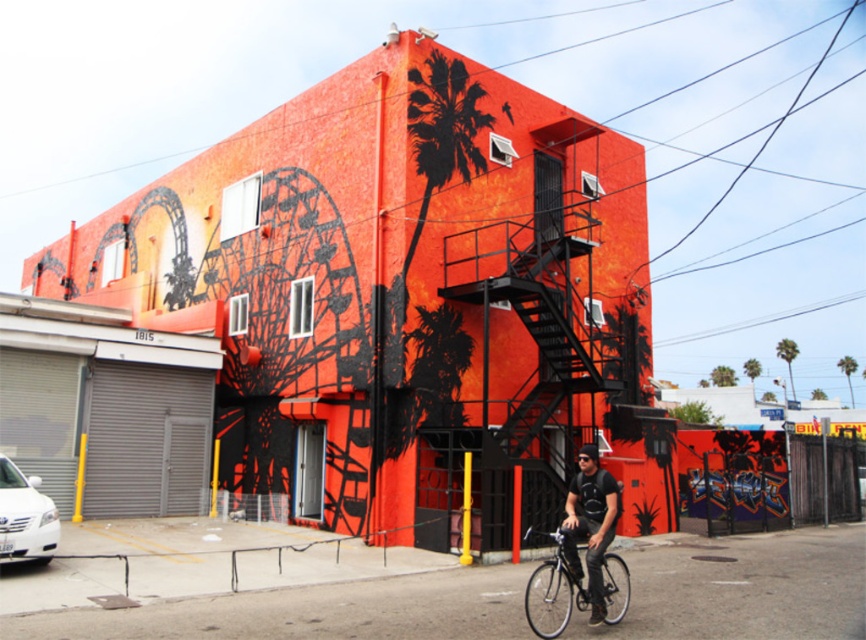
Question: Among these objects, which one is farthest from the camera?

Choices:
 (A) shiny silver bicycle at lower center
 (B) matte black bicycle at lower right

Answer: (B)

Question: Is shiny silver bicycle at lower center positioned before matte black bicycle at lower right?

Choices:
 (A) no
 (B) yes

Answer: (B)

Question: Can you confirm if shiny silver bicycle at lower center is positioned to the right of matte black bicycle at lower right?

Choices:
 (A) no
 (B) yes

Answer: (A)

Question: Among these objects, which one is nearest to the camera?

Choices:
 (A) matte black bicycle at lower right
 (B) shiny silver bicycle at lower center

Answer: (B)

Question: Is shiny silver bicycle at lower center bigger than matte black bicycle at lower right?

Choices:
 (A) no
 (B) yes

Answer: (B)